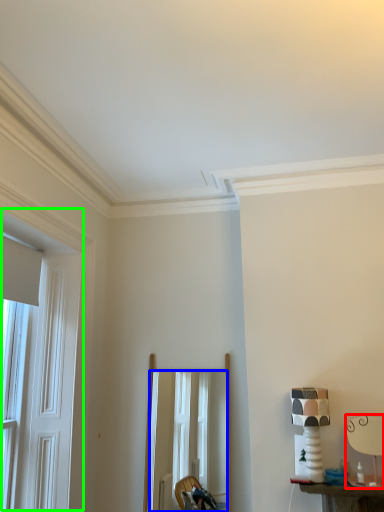
Question: Based on their relative distances, which object is nearer to table lamp (highlighted by a red box)? Choose from mirror (highlighted by a blue box) and window (highlighted by a green box).

Choices:
 (A) mirror
 (B) window

Answer: (A)